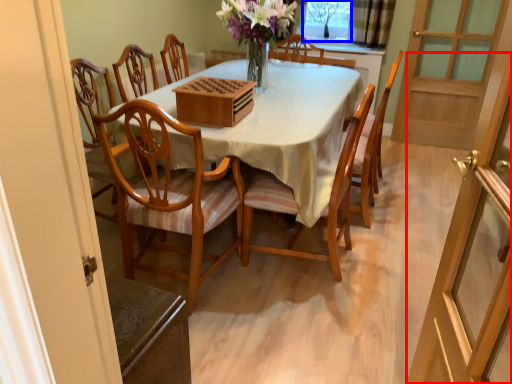
Question: Which point is closer to the camera, screen door (highlighted by a red box) or window screen (highlighted by a blue box)?

Choices:
 (A) screen door
 (B) window screen

Answer: (A)